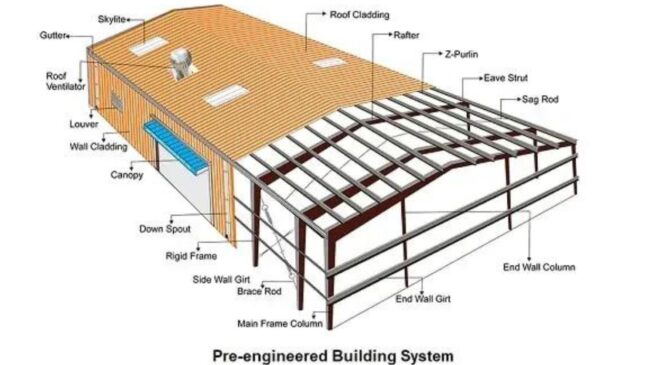
I want to click on louver, so click(110, 87).